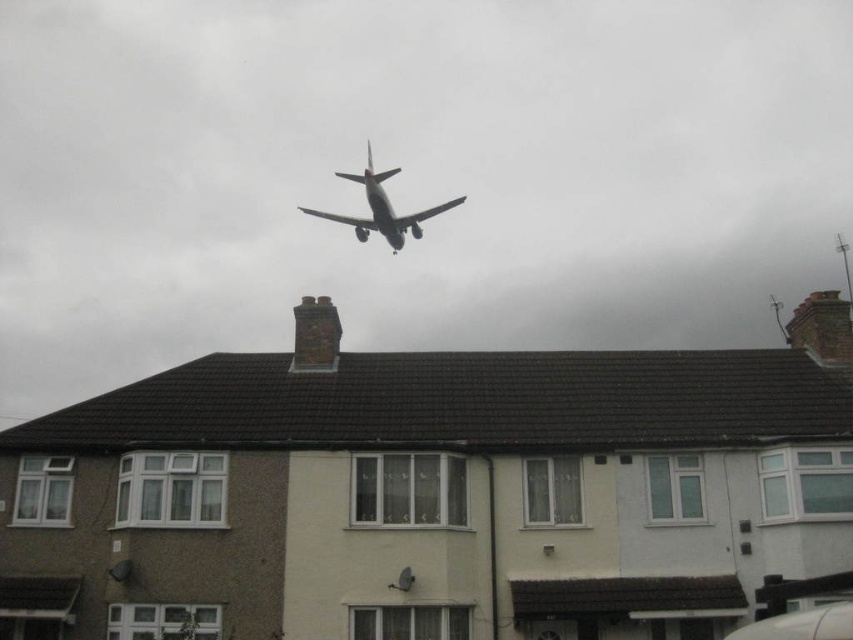
Find the location of a particular element. Image resolution: width=853 pixels, height=640 pixels. brick chimney at upper right is located at coordinates (822, 326).

Locate an element on the screen. This screenshot has height=640, width=853. brick chimney at upper right is located at coordinates (822, 326).

Does brick chimney at upper right lie in front of brick chimney at center?

No.

Does brick chimney at upper right come behind brick chimney at center?

Yes, brick chimney at upper right is further from the viewer.

Who is more forward, (809, 301) or (321, 326)?

Positioned in front is point (321, 326).

This screenshot has width=853, height=640. I want to click on brick chimney at upper right, so click(x=822, y=326).

Between point (430, 212) and point (321, 321), which one is positioned behind?

Positioned behind is point (430, 212).

Looking at this image, is silver metallic airplane at center closer to the viewer compared to brick chimney at center?

No, silver metallic airplane at center is further to the viewer.

Who is more distant from viewer, (379, 211) or (296, 371)?

Point (379, 211)

Where is `silver metallic airplane at center`? silver metallic airplane at center is located at coordinates (381, 209).